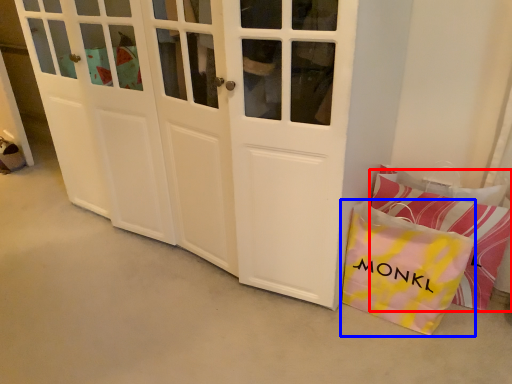
Question: Among these objects, which one is nearest to the camera, pillow (highlighted by a red box) or gift bag (highlighted by a blue box)?

Choices:
 (A) pillow
 (B) gift bag

Answer: (B)